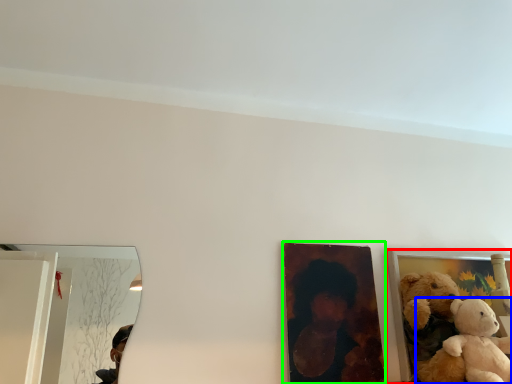
Question: Which object is positioned closest to picture frame (highlighted by a red box)? Select from teddy bear (highlighted by a blue box) and picture frame (highlighted by a green box).

Choices:
 (A) teddy bear
 (B) picture frame

Answer: (B)